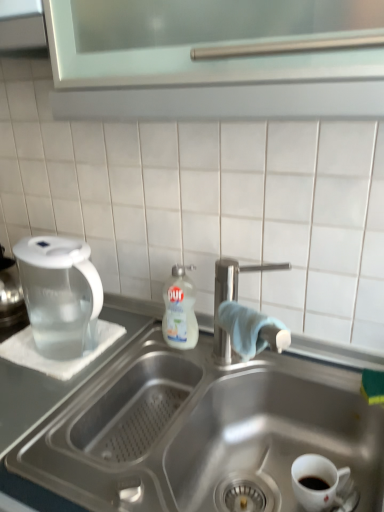
What do you see at coordinates (182, 428) in the screenshot? The height and width of the screenshot is (512, 384). I see `stainless steel sink at center` at bounding box center [182, 428].

Describe the element at coordinates (59, 292) in the screenshot. I see `transparent plastic pitcher at left` at that location.

The width and height of the screenshot is (384, 512). In order to click on white glossy mug at lower right in this screenshot , I will do `click(318, 477)`.

I want to click on white glossy dish soap at center, so click(x=180, y=310).

Which object is positioned more to the right, satin nickel faucet at sink center or transparent plastic pitcher at left?

satin nickel faucet at sink center.

Is point (222, 356) positioned in front of point (30, 277)?

No.

Does satin nickel faucet at sink center turn towards transparent plastic pitcher at left?

No, satin nickel faucet at sink center is not aimed at transparent plastic pitcher at left.

Would you consider satin nickel faucet at sink center to be distant from transparent plastic pitcher at left?

That's not correct — satin nickel faucet at sink center is a little close to transparent plastic pitcher at left.

Is white glossy dish soap at center turned away from satin nickel faucet at sink center?

No, white glossy dish soap at center's orientation is not away from satin nickel faucet at sink center.

Can you tell me how much white glossy dish soap at center and satin nickel faucet at sink center differ in facing direction?

The angular difference between white glossy dish soap at center and satin nickel faucet at sink center is 0.611 degrees.

Based on the photo, from the image's perspective, which is below, white glossy dish soap at center or satin nickel faucet at sink center?

satin nickel faucet at sink center appears lower in the image.

Find the location of a particular element. Image resolution: width=384 pixels, height=512 pixels. tap above the white glossy dish soap at center (from a real-world perspective) is located at coordinates (231, 297).

Looking at the image, does satin nickel faucet at sink center seem bigger or smaller compared to white glossy dish soap at center?

satin nickel faucet at sink center is bigger than white glossy dish soap at center.

Is satin nickel faucet at sink center inside the boundaries of white glossy dish soap at center, or outside?

satin nickel faucet at sink center is not inside white glossy dish soap at center, it's outside.

From the image's perspective, between satin nickel faucet at sink center and white glossy dish soap at center, who is located below?

satin nickel faucet at sink center is shown below in the image.

Considering the positions of objects satin nickel faucet at sink center and white glossy dish soap at center in the image provided, who is behind, satin nickel faucet at sink center or white glossy dish soap at center?

white glossy dish soap at center is behind.

Considering the sizes of objects white glossy dish soap at center and stainless steel sink at center in the image provided, who is bigger, white glossy dish soap at center or stainless steel sink at center?

Bigger between the two is stainless steel sink at center.

Which object is further away from the camera, white glossy dish soap at center or stainless steel sink at center?

white glossy dish soap at center is more distant.

From the picture: Is white glossy dish soap at center turned away from stainless steel sink at center?

white glossy dish soap at center does not have its back to stainless steel sink at center.

From the image's perspective, is white glossy dish soap at center positioned above or below stainless steel sink at center?

Based on their image positions, white glossy dish soap at center is located above stainless steel sink at center.

Is stainless steel sink at center facing away from white glossy mug at lower right?

Correct, stainless steel sink at center is looking away from white glossy mug at lower right.

I want to click on sink lying in front of the white glossy mug at lower right, so click(182, 428).

Considering the relative sizes of stainless steel sink at center and white glossy mug at lower right in the image provided, is stainless steel sink at center shorter than white glossy mug at lower right?

No.

Could white glossy mug at lower right be considered to be inside stainless steel sink at center?

Yes, white glossy mug at lower right is a part of stainless steel sink at center.

From a real-world perspective, which object rests below the other?

stainless steel sink at center.

Is satin nickel faucet at sink center at the right side of stainless steel sink at center?

Yes.

Is satin nickel faucet at sink center far away from stainless steel sink at center?

satin nickel faucet at sink center is actually quite close to stainless steel sink at center.

How many degrees apart are the facing directions of satin nickel faucet at sink center and stainless steel sink at center?

The angular difference between satin nickel faucet at sink center and stainless steel sink at center is 1.85 degrees.

From a real-world perspective, which is physically below, white glossy dish soap at center or white glossy mug at lower right?

From a 3D spatial view, white glossy mug at lower right is below.

Is white glossy dish soap at center not within white glossy mug at lower right?

Yes, white glossy dish soap at center is not within white glossy mug at lower right.

From the image's perspective, would you say white glossy dish soap at center is shown under white glossy mug at lower right?

Actually, white glossy dish soap at center appears above white glossy mug at lower right in the image.

The width and height of the screenshot is (384, 512). I want to click on coffee maker behind the satin nickel faucet at sink center, so click(59, 292).

There is a white glossy dish soap at center. At what (x,y) coordinates should I click in order to perform the action: click on tap above it (from a real-world perspective). Please return your answer as a coordinate pair (x, y). This screenshot has width=384, height=512. Looking at the image, I should click on (231, 297).

From the picture: From the image, which object appears to be nearer to transparent plastic pitcher at left, white glossy dish soap at center or stainless steel sink at center?

white glossy dish soap at center lies closer to transparent plastic pitcher at left than the other object.

Which object lies nearer to the anchor point stainless steel sink at center, white glossy dish soap at center or satin nickel faucet at sink center?

The object closer to stainless steel sink at center is satin nickel faucet at sink center.

Looking at the image, which one is located further to satin nickel faucet at sink center, white glossy dish soap at center or transparent plastic pitcher at left?

The object further to satin nickel faucet at sink center is transparent plastic pitcher at left.

Looking at the image, which one is located closer to white glossy dish soap at center, white glossy mug at lower right or satin nickel faucet at sink center?

Based on the image, satin nickel faucet at sink center appears to be nearer to white glossy dish soap at center.

Which object lies further to the anchor point satin nickel faucet at sink center, white glossy mug at lower right or transparent plastic pitcher at left?

Based on the image, transparent plastic pitcher at left appears to be further to satin nickel faucet at sink center.

Looking at the image, which one is located closer to transparent plastic pitcher at left, white glossy dish soap at center or white glossy mug at lower right?

white glossy dish soap at center is closer to transparent plastic pitcher at left.

Estimate the real-world distances between objects in this image. Which object is closer to stainless steel sink at center, satin nickel faucet at sink center or white glossy dish soap at center?

satin nickel faucet at sink center is closer to stainless steel sink at center.

From the image, which object appears to be nearer to white glossy mug at lower right, transparent plastic pitcher at left or white glossy dish soap at center?

white glossy dish soap at center lies closer to white glossy mug at lower right than the other object.

This screenshot has height=512, width=384. What are the coordinates of `tap between white glossy dish soap at center and white glossy mug at lower right in the up-down direction` in the screenshot? It's located at coord(231,297).

The height and width of the screenshot is (512, 384). Identify the location of coffee maker between stainless steel sink at center and white glossy mug at lower right in the horizontal direction. (59, 292).

Where is `tap between white glossy dish soap at center and stainless steel sink at center from top to bottom`? This screenshot has height=512, width=384. tap between white glossy dish soap at center and stainless steel sink at center from top to bottom is located at coordinates (231, 297).

Identify the location of tap between transparent plastic pitcher at left and white glossy mug at lower right in the horizontal direction. The height and width of the screenshot is (512, 384). (231, 297).